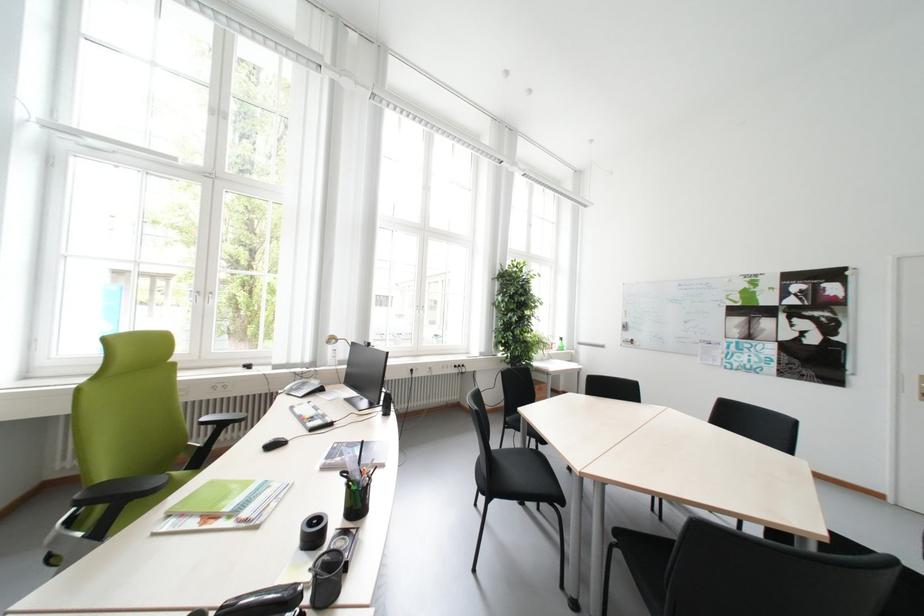
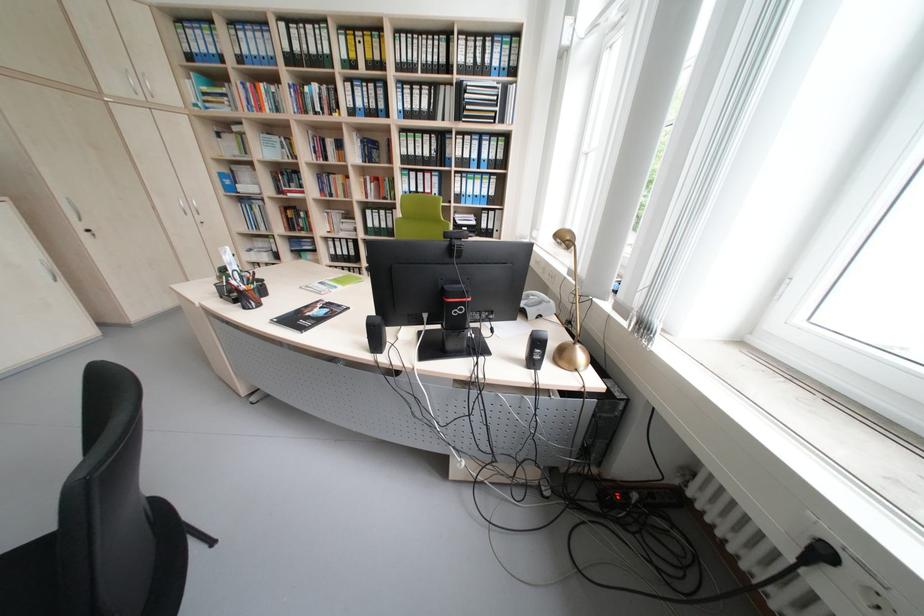
Where in the second image is the point corresponding to pixel 421 371 from the first image?

(833, 554)